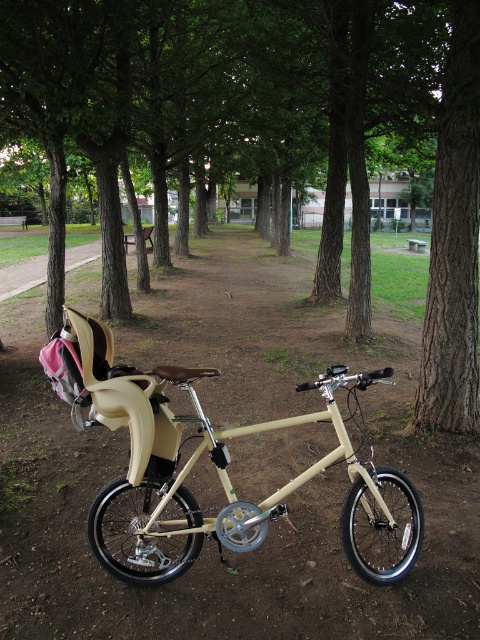
You are a park visitor who wants to walk from the left side of the path to the right side. You see the beige matte bicycle at center and the beige matte baby carriage at center. Which object should you go around to avoid stepping on the dirt path?

You should go around the beige matte baby carriage at center because the beige matte bicycle at center is to the right of it, so the baby carriage is closer to the left side of the path.

You are a parent pushing a beige matte baby carriage at center through a park. There is a brown wood tree at center in your path. Can you pass through the space between them without the carriage hitting the tree?

The brown wood tree at center is larger in size than the beige matte baby carriage at center, but since both are at the center, the carriage might not have enough space to pass. You should check the actual distance between them before proceeding.

You are a park visitor trying to take a photo of the beige matte bicycle at center without any obstructions. Since the brown wood tree at center is in the way, can you move the tree to get a clear shot?

The brown wood tree at center is a large object and cannot be moved easily, so you cannot move it to get a clear shot of the beige matte bicycle at center.